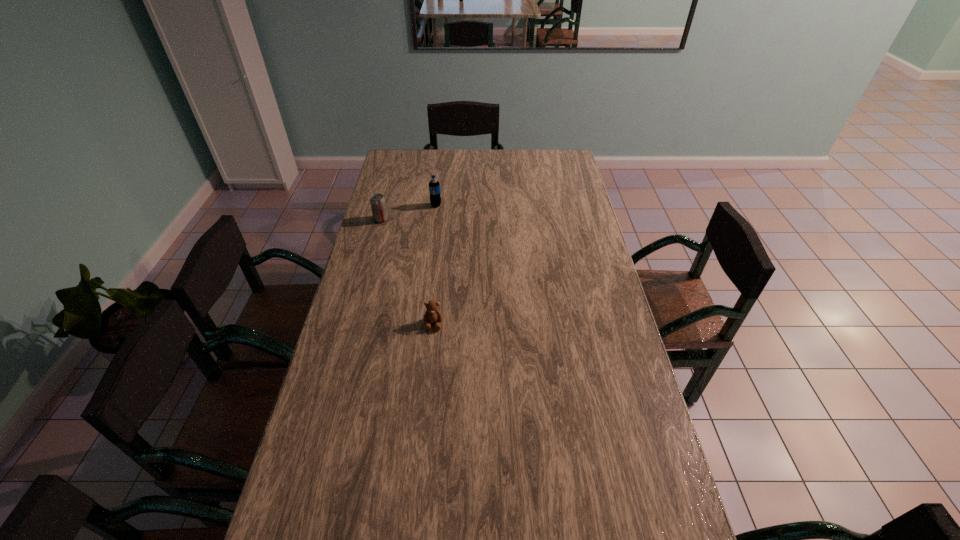
In the image, there is a desktop. Where is `vacant space at the far edge`? The width and height of the screenshot is (960, 540). vacant space at the far edge is located at coordinates (454, 167).

Image resolution: width=960 pixels, height=540 pixels. In the image, there is a desktop. Identify the location of vacant space at the left edge. (333, 374).

You are a GUI agent. You are given a task and a screenshot of the screen. Output one action in this format:
    pyautogui.click(x=<x>, y=<y>)
    Task: Click on the free space at the right edge of the desktop
    The height and width of the screenshot is (540, 960).
    Given the screenshot: What is the action you would take?
    pyautogui.click(x=607, y=294)

In order to click on vacant area that lies between the second tallest object and the farthest object in this screenshot , I will do `click(409, 212)`.

This screenshot has width=960, height=540. I want to click on vacant area that lies between the second nearest object and the taller soda can, so click(409, 212).

You are a GUI agent. You are given a task and a screenshot of the screen. Output one action in this format:
    pyautogui.click(x=<x>, y=<y>)
    Task: Click on the vacant area that lies between the shortest object and the nearer soda can
    This screenshot has height=540, width=960.
    Given the screenshot: What is the action you would take?
    pyautogui.click(x=407, y=272)

At what (x,y) coordinates should I click in order to perform the action: click on free area in between the second farthest object and the nearest object. Please return your answer as a coordinate pair (x, y). Looking at the image, I should click on (407, 272).

Find the location of a particular element. Image resolution: width=960 pixels, height=540 pixels. free area in between the farther soda can and the shorter soda can is located at coordinates (409, 212).

This screenshot has height=540, width=960. I want to click on free space that is in between the left soda can and the tallest object, so tap(409, 212).

Identify the location of object that is the closest to the shortest object. (378, 205).